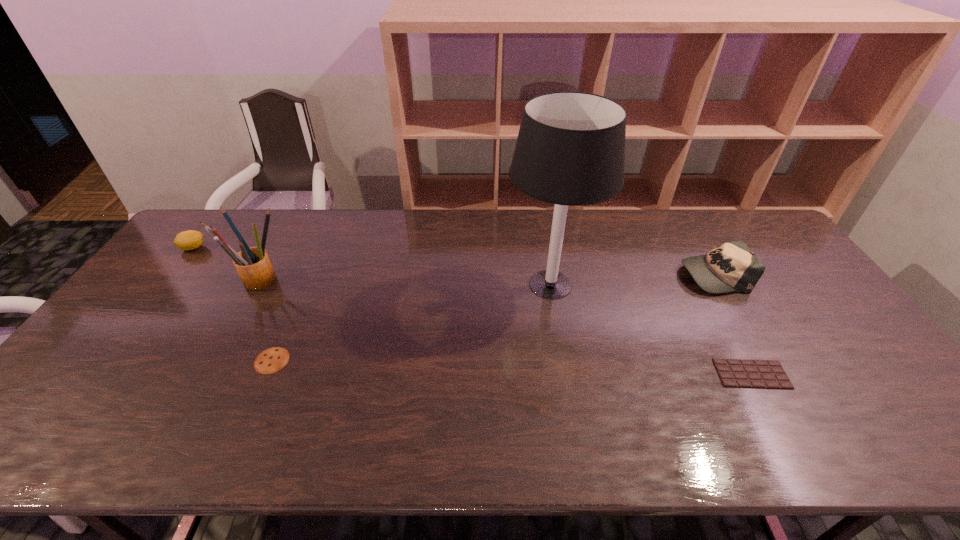
Where is `object present at the far left corner`? object present at the far left corner is located at coordinates (188, 240).

Locate an element on the screen. vacant space at the far edge of the desktop is located at coordinates [x=339, y=246].

In the image, there is a desktop. Where is `free space at the near edge`? The image size is (960, 540). free space at the near edge is located at coordinates (235, 454).

Where is `free space at the left edge of the desktop`? The height and width of the screenshot is (540, 960). free space at the left edge of the desktop is located at coordinates (125, 377).

Identify the location of vacant space at the right edge of the desktop. The height and width of the screenshot is (540, 960). (828, 321).

Find the location of a particular element. vacant area between the third object from right to left and the shortest object is located at coordinates (651, 329).

Where is `vacant area that lies between the cookie and the shortest object`? vacant area that lies between the cookie and the shortest object is located at coordinates (512, 367).

This screenshot has height=540, width=960. Identify the location of blank region between the lemon and the tallest object. (372, 266).

What are the coordinates of `free space between the second shortest object and the baseball cap` in the screenshot? It's located at (492, 318).

You are a GUI agent. You are given a task and a screenshot of the screen. Output one action in this format:
    pyautogui.click(x=<x>, y=<y>)
    Task: Click on the free space between the cookie and the tallest object
    The image size is (960, 540).
    Given the screenshot: What is the action you would take?
    pyautogui.click(x=411, y=322)